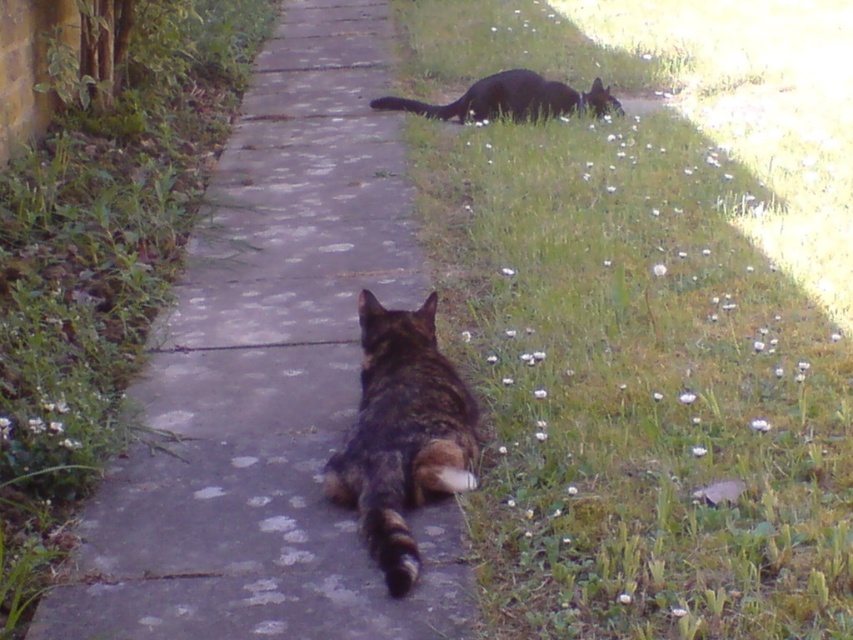
Question: Where is green grass at upper right located in relation to black fur cat at upper right in the image?

Choices:
 (A) above
 (B) below

Answer: (B)

Question: Observing the image, what is the correct spatial positioning of green grass at upper right in reference to black fur cat at upper right?

Choices:
 (A) below
 (B) above

Answer: (A)

Question: Estimate the real-world distances between objects in this image. Which object is farther from the tabby fur cat at center?

Choices:
 (A) black fur cat at upper right
 (B) gray concrete pavement at center
 (C) green grass at upper right

Answer: (A)

Question: Which point is farther to the camera?

Choices:
 (A) (151, 524)
 (B) (424, 432)
 (C) (689, 449)

Answer: (C)

Question: Is gray concrete pavement at center to the right of black fur cat at upper right from the viewer's perspective?

Choices:
 (A) no
 (B) yes

Answer: (A)

Question: Which point is farther from the camera taking this photo?

Choices:
 (A) (578, 109)
 (B) (238, 177)

Answer: (A)